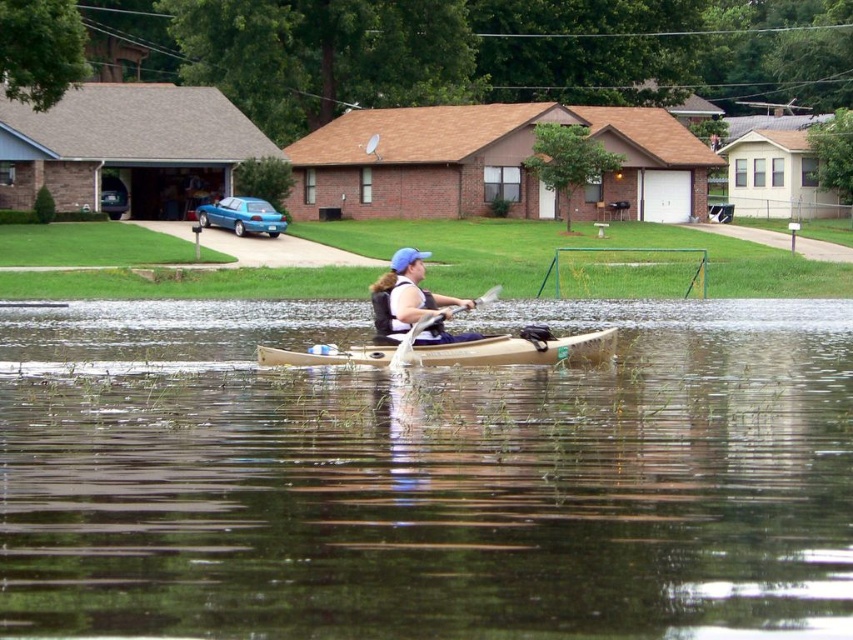
Can you confirm if brown matte water at center is taller than wooden paddle at center?

Indeed, brown matte water at center has a greater height compared to wooden paddle at center.

Is point (506, 321) positioned in front of point (469, 339)?

That is False.

Which is behind, point (714, 342) or point (479, 298)?

Point (479, 298)

Find the location of a particular element. brown matte water at center is located at coordinates 425,477.

Does brown matte water at center lie behind matte blue life vest at center?

That is False.

Who is more distant from viewer, (508, 573) or (422, 300)?

The point (422, 300) is behind.

You are a GUI agent. You are given a task and a screenshot of the screen. Output one action in this format:
    pyautogui.click(x=<x>, y=<y>)
    Task: Click on the brown matte water at center
    
    Given the screenshot: What is the action you would take?
    pyautogui.click(x=425, y=477)

From the picture: Who is more forward, (613, 420) or (260, 349)?

Point (613, 420)

Who is lower down, brown matte water at center or tan matte canoe at center?

brown matte water at center is below.

Does point (42, 352) come closer to viewer compared to point (360, 356)?

No.

The width and height of the screenshot is (853, 640). Find the location of `brown matte water at center`. brown matte water at center is located at coordinates (425, 477).